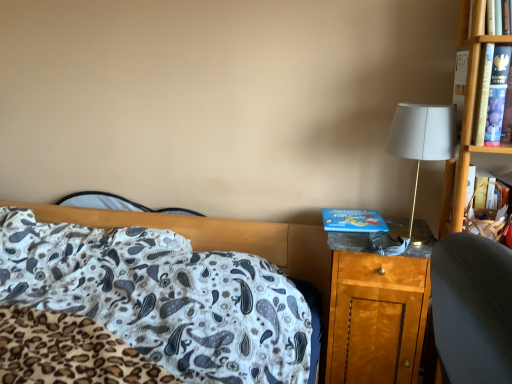
Locate an element on the screen. This screenshot has height=384, width=512. vacant area that lies in front of blue cardboard book at right is located at coordinates (365, 238).